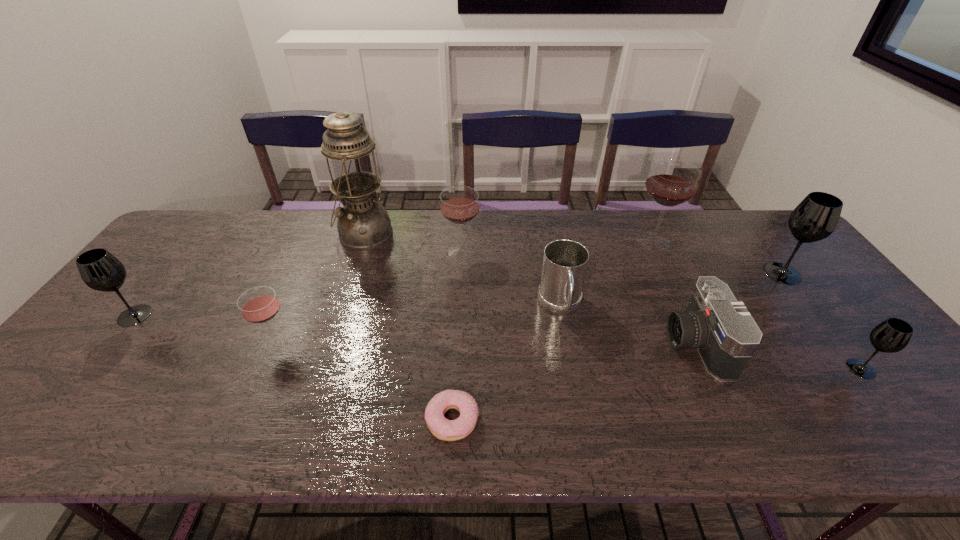
You are a GUI agent. You are given a task and a screenshot of the screen. Output one action in this format:
    pyautogui.click(x=<x>, y=<y>)
    Task: Click on the object present at the near edge
    This screenshot has width=960, height=540.
    Given the screenshot: What is the action you would take?
    pyautogui.click(x=448, y=430)

Identify the location of object that is at the left edge. The image size is (960, 540). (100, 270).

The width and height of the screenshot is (960, 540). What are the coordinates of `vacant region at the far edge` in the screenshot? It's located at (596, 236).

The height and width of the screenshot is (540, 960). I want to click on vacant space at the near edge, so click(359, 445).

Locate an element on the screen. This screenshot has height=540, width=960. blank space at the left edge of the desktop is located at coordinates (189, 258).

The image size is (960, 540). I want to click on free spot at the right edge of the desktop, so click(x=849, y=307).

I want to click on vacant space at the near left corner, so click(67, 435).

At what (x,y) coordinates should I click in order to perform the action: click on vacant space at the far right corner of the desktop. Please return your answer as a coordinate pair (x, y). Looking at the image, I should click on (787, 245).

This screenshot has width=960, height=540. What are the coordinates of `unoccupied position between the nearest object and the leftmost red wineglass` in the screenshot? It's located at (364, 381).

Image resolution: width=960 pixels, height=540 pixels. I want to click on free space between the second red wineglass from right to left and the third nearest wineglass, so click(x=298, y=284).